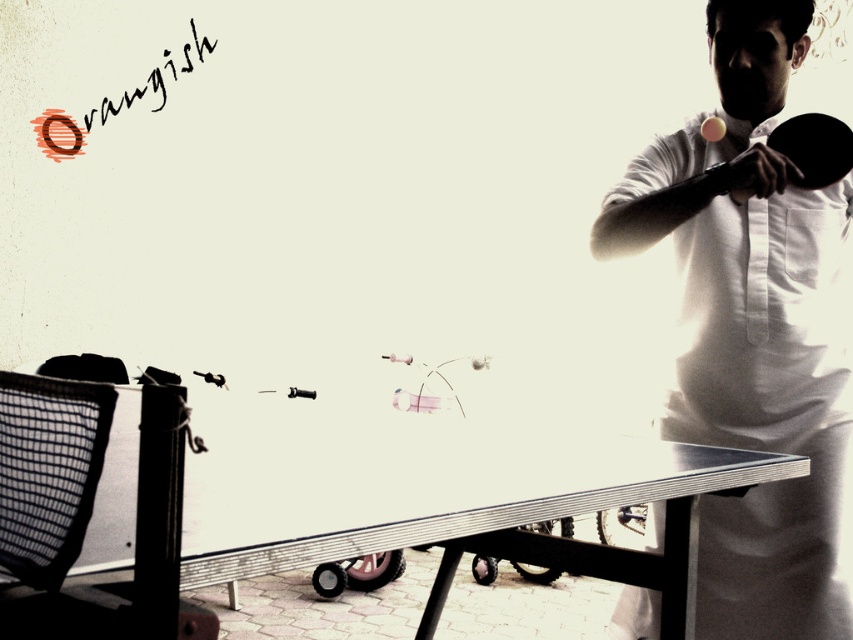
You are a ping pong player trying to choose a paddle for a game. Both the white matte ping pong paddle at upper right and the black rubber paddle at upper right are available. Which paddle has a greater width?

The white matte ping pong paddle at upper right has a greater width than the black rubber paddle at upper right.

You are a photographer trying to capture the exact position of the white matte ping pong paddle at upper right and the black rubber paddle at upper right. Based on the scene description, which paddle is positioned lower in the image?

The white matte ping pong paddle at upper right is located below the black rubber paddle at upper right, so it is positioned lower in the image.